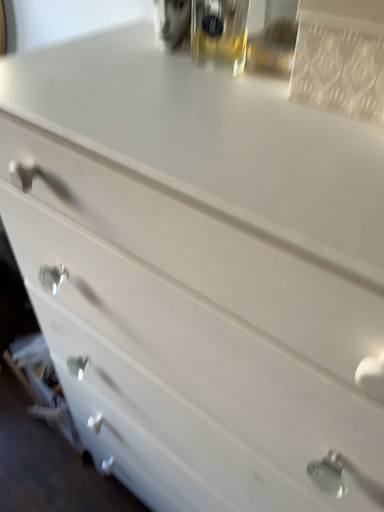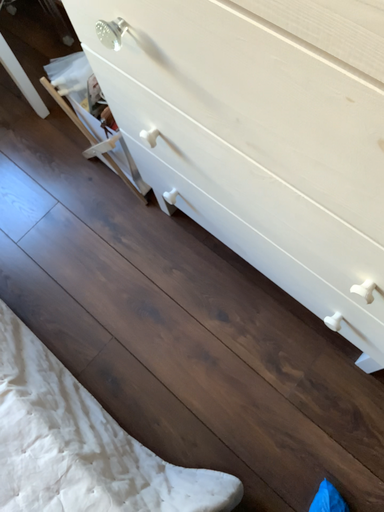
Question: How did the camera likely rotate when shooting the video?

Choices:
 (A) rotated downward
 (B) rotated upward

Answer: (A)